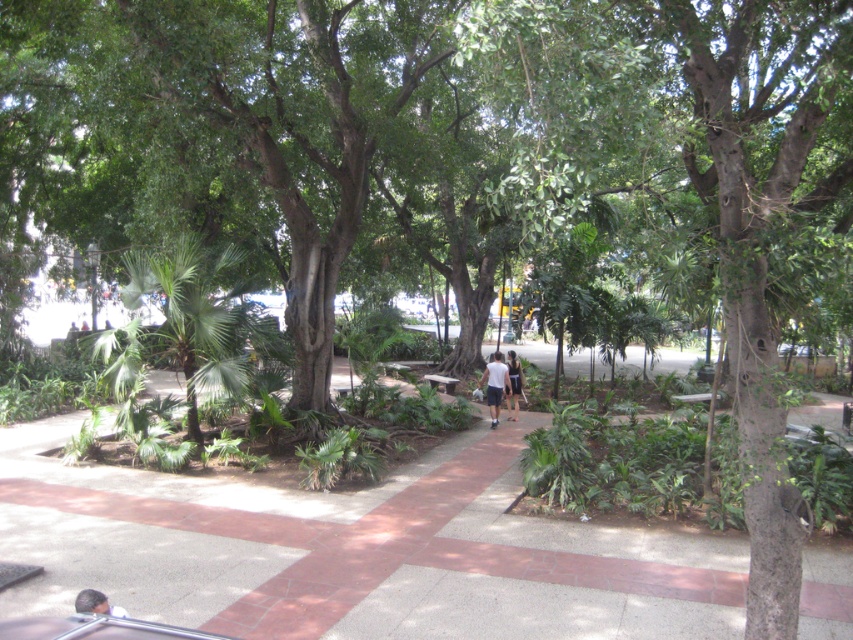
Can you confirm if dark brown hair at lower left is shorter than wooden park bench at center?

Yes, dark brown hair at lower left is shorter than wooden park bench at center.

What do you see at coordinates (96, 604) in the screenshot? I see `dark brown hair at lower left` at bounding box center [96, 604].

The height and width of the screenshot is (640, 853). Find the location of `dark brown hair at lower left`. dark brown hair at lower left is located at coordinates (96, 604).

This screenshot has height=640, width=853. In order to click on dark brown hair at lower left in this screenshot , I will do `click(96, 604)`.

Image resolution: width=853 pixels, height=640 pixels. Identify the location of white fabric shorts at center. pyautogui.click(x=514, y=385).

Can you confirm if white fabric shorts at center is wider than wooden park bench at center?

No.

Locate an element on the screen. Image resolution: width=853 pixels, height=640 pixels. white fabric shorts at center is located at coordinates (514, 385).

Does white cotton couple at center appear under wooden park bench at center?

Actually, white cotton couple at center is above wooden park bench at center.

Is point (497, 385) more distant than point (450, 392)?

No, it is not.

Identify the location of white cotton couple at center. (500, 381).